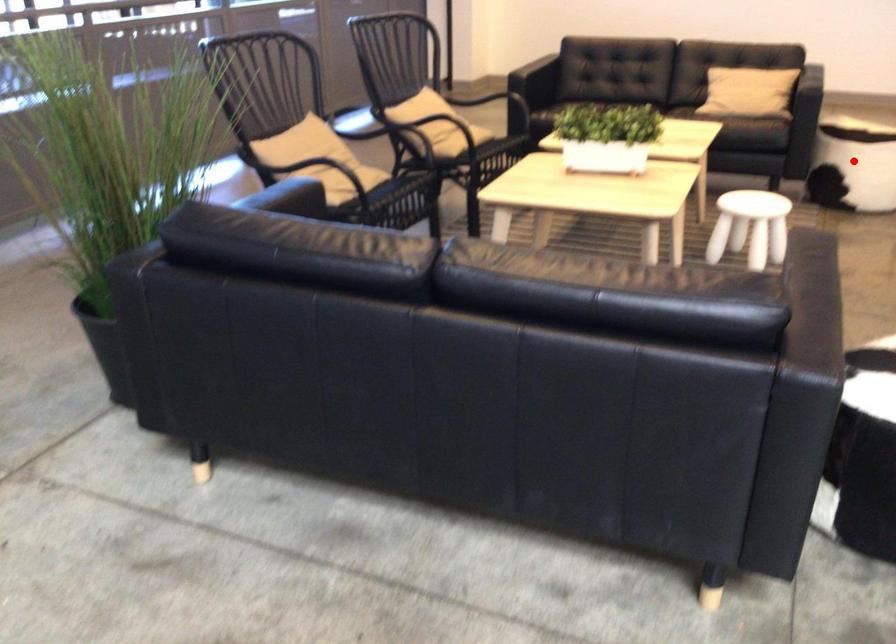
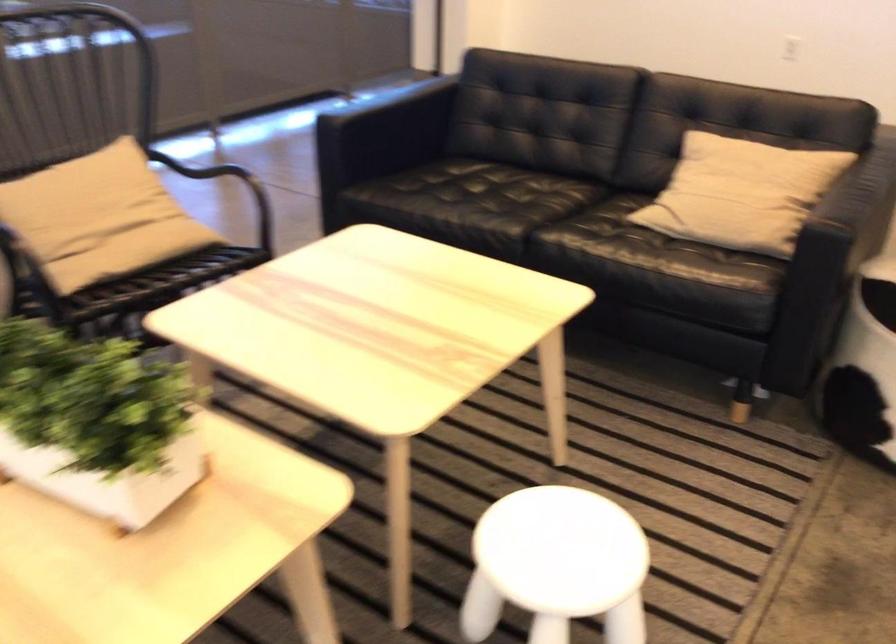
Question: I am providing you with two images of the same scene from different viewpoints. A red point is marked on the first image. At the location where the point appears in image 1, is it still visible in image 2?

Choices:
 (A) Yes
 (B) No

Answer: (B)